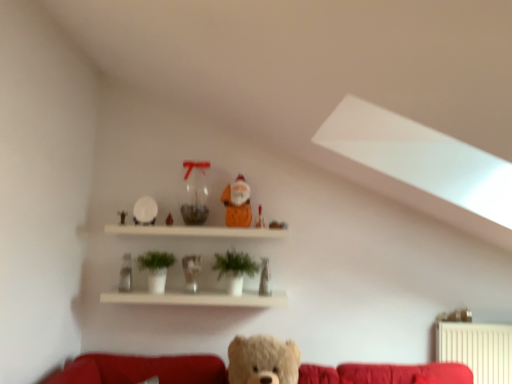
Question: Can you confirm if transparent glass vase at center is positioned to the right of white glossy shelf at upper center?

Choices:
 (A) yes
 (B) no

Answer: (B)

Question: From a real-world perspective, is transparent glass vase at center positioned over white glossy shelf at upper center based on gravity?

Choices:
 (A) yes
 (B) no

Answer: (A)

Question: Is transparent glass vase at center positioned before white glossy shelf at upper center?

Choices:
 (A) no
 (B) yes

Answer: (A)

Question: Is transparent glass vase at center to the left of white glossy shelf at upper center from the viewer's perspective?

Choices:
 (A) no
 (B) yes

Answer: (B)

Question: Does transparent glass vase at center have a greater width compared to white glossy shelf at upper center?

Choices:
 (A) yes
 (B) no

Answer: (B)

Question: Is transparent glass vase at center positioned behind white glossy shelf at upper center?

Choices:
 (A) no
 (B) yes

Answer: (B)

Question: Is matte orange santa at upper center, the 4th toy viewed from the left, facing towards green matte plant at center?

Choices:
 (A) no
 (B) yes

Answer: (A)

Question: Does matte orange santa at upper center, the 4th toy viewed from the left, lie behind green matte plant at center?

Choices:
 (A) yes
 (B) no

Answer: (A)

Question: Is green matte plant at center at the back of matte orange santa at upper center, the second toy positioned from the right?

Choices:
 (A) yes
 (B) no

Answer: (B)

Question: Is matte orange santa at upper center, the second toy positioned from the right, thinner than green matte plant at center?

Choices:
 (A) yes
 (B) no

Answer: (A)

Question: Does matte orange santa at upper center, the 4th toy viewed from the left, appear on the left side of green matte plant at center?

Choices:
 (A) yes
 (B) no

Answer: (B)

Question: Considering the relative positions of matte orange santa at upper center, the 4th toy viewed from the left, and green matte plant at center in the image provided, is matte orange santa at upper center, the 4th toy viewed from the left, in front of green matte plant at center?

Choices:
 (A) yes
 (B) no

Answer: (B)

Question: Is green matte plant at center not close to translucent glass figurine at center, which ranks as the first figurine in left-to-right order?

Choices:
 (A) no
 (B) yes

Answer: (A)